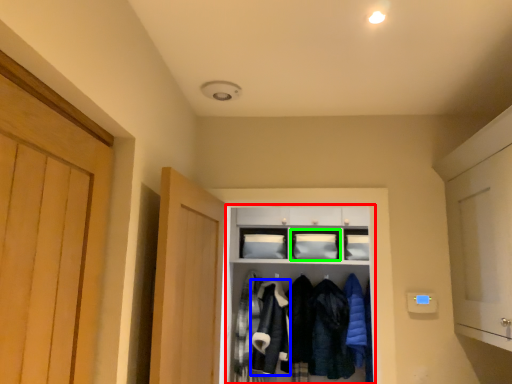
Question: Considering the real-world distances, which object is closest to cabinetry (highlighted by a red box)? clothing (highlighted by a blue box) or cabinetry (highlighted by a green box).

Choices:
 (A) clothing
 (B) cabinetry

Answer: (B)